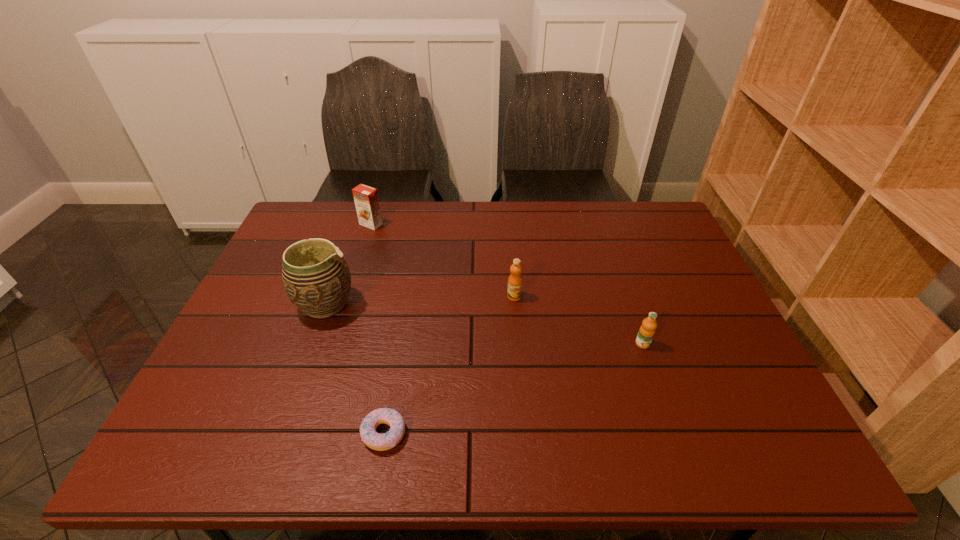
You are a GUI agent. You are given a task and a screenshot of the screen. Output one action in this format:
    pyautogui.click(x=<x>, y=<y>)
    Task: Click on the tallest object
    Image resolution: width=960 pixels, height=540 pixels.
    Given the screenshot: What is the action you would take?
    pyautogui.click(x=316, y=278)

Locate an element on the screen. The width and height of the screenshot is (960, 540). the farthest object is located at coordinates (366, 200).

Find the location of a particular element. Image resolution: width=960 pixels, height=540 pixels. the leftmost orange juice is located at coordinates (366, 200).

The width and height of the screenshot is (960, 540). In order to click on the second orange juice from right to left in this screenshot , I will do `click(515, 281)`.

Locate an element on the screen. the second nearest orange juice is located at coordinates (515, 281).

Locate an element on the screen. the rightmost orange juice is located at coordinates (646, 332).

Locate an element on the screen. The width and height of the screenshot is (960, 540). the fourth tallest object is located at coordinates (646, 332).

At what (x,y) coordinates should I click in order to perform the action: click on the third object from left to right. Please return your answer as a coordinate pair (x, y). The height and width of the screenshot is (540, 960). Looking at the image, I should click on (381, 442).

Locate an element on the screen. doughnut is located at coordinates (381, 442).

I want to click on vacant area situated on the right of the pottery, so click(482, 305).